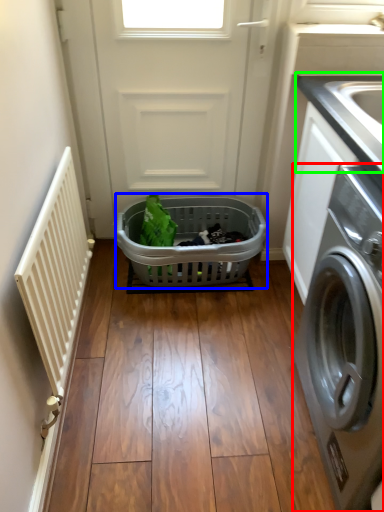
Question: Based on their relative distances, which object is nearer to washing machine (highlighted by a red box)? Choose from basket (highlighted by a blue box) and counter top (highlighted by a green box).

Choices:
 (A) basket
 (B) counter top

Answer: (B)